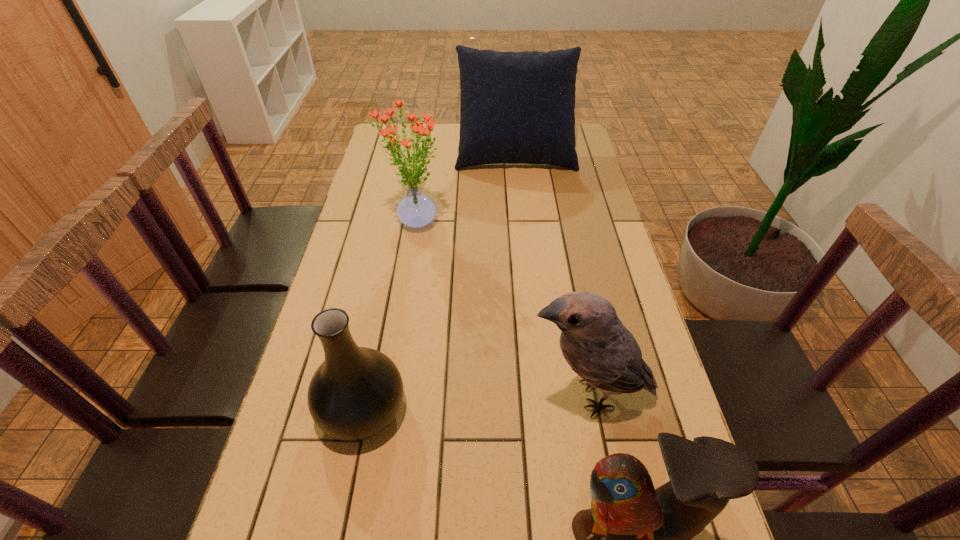
At what (x,y) coordinates should I click in order to perform the action: click on object that is at the far edge. Please return your answer as a coordinate pair (x, y). The width and height of the screenshot is (960, 540). Looking at the image, I should click on (515, 107).

You are a GUI agent. You are given a task and a screenshot of the screen. Output one action in this format:
    pyautogui.click(x=<x>, y=<y>)
    Task: Click on the flower arrangement that is at the left edge
    
    Given the screenshot: What is the action you would take?
    pyautogui.click(x=416, y=210)

You are a GUI agent. You are given a task and a screenshot of the screen. Output one action in this format:
    pyautogui.click(x=<x>, y=<y>)
    Task: Click on the vase situated at the left edge
    
    Given the screenshot: What is the action you would take?
    pyautogui.click(x=356, y=392)

You are a GUI agent. You are given a task and a screenshot of the screen. Output one action in this format:
    pyautogui.click(x=<x>, y=<y>)
    Task: Click on the cushion that is at the right edge
    
    Given the screenshot: What is the action you would take?
    pyautogui.click(x=515, y=107)

At what (x,y) coordinates should I click in order to perform the action: click on parrot that is positioned at the right edge. Please return your answer as a coordinate pair (x, y). The image size is (960, 540). Looking at the image, I should click on (594, 342).

Locate an element on the screen. The image size is (960, 540). object at the far right corner is located at coordinates (515, 107).

The image size is (960, 540). Find the location of `free space at the far edge`. free space at the far edge is located at coordinates (432, 149).

Locate an element on the screen. Image resolution: width=960 pixels, height=540 pixels. free space at the left edge is located at coordinates (402, 161).

Image resolution: width=960 pixels, height=540 pixels. Find the location of `free space at the right edge of the desktop`. free space at the right edge of the desktop is located at coordinates (615, 296).

Locate an element on the screen. The image size is (960, 540). vacant space that is in between the farthest object and the farther parrot is located at coordinates (552, 272).